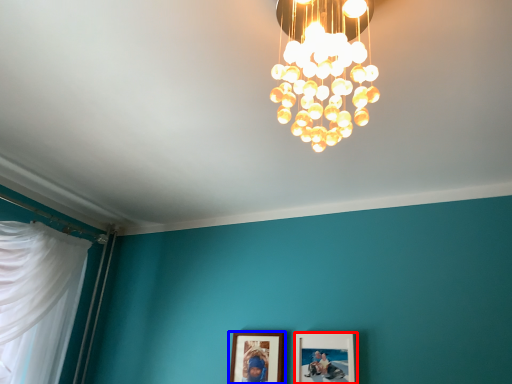
Question: Among these objects, which one is nearest to the camera, picture frame (highlighted by a red box) or picture frame (highlighted by a blue box)?

Choices:
 (A) picture frame
 (B) picture frame

Answer: (A)